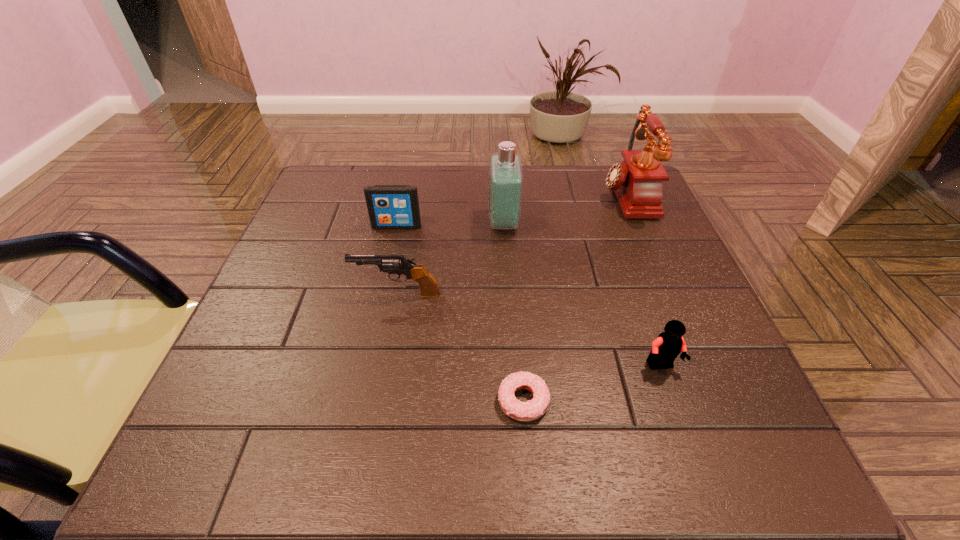
Identify the location of telephone. This screenshot has width=960, height=540. (637, 182).

You are a GUI agent. You are given a task and a screenshot of the screen. Output one action in this format:
    pyautogui.click(x=<x>, y=<y>)
    Task: Click on the perfume
    Image resolution: width=960 pixels, height=540 pixels.
    Given the screenshot: What is the action you would take?
    pyautogui.click(x=505, y=173)

This screenshot has height=540, width=960. I want to click on iPod, so click(389, 206).

Identify the location of gun. The width and height of the screenshot is (960, 540). (392, 264).

What are the coordinates of `the fifth farthest object` in the screenshot? It's located at (666, 347).

Locate an element on the screen. The width and height of the screenshot is (960, 540). doughnut is located at coordinates (533, 409).

Image resolution: width=960 pixels, height=540 pixels. What are the coordinates of `the shortest object` in the screenshot? It's located at (533, 409).

This screenshot has width=960, height=540. I want to click on vacant space located on the dial of the telephone, so click(x=477, y=195).

At what (x,y) coordinates should I click in order to perform the action: click on free point located 0.220m on the dial of the telephone. Please return your answer as a coordinate pair (x, y). This screenshot has height=540, width=960. Looking at the image, I should click on (516, 195).

At what (x,y) coordinates should I click in order to perform the action: click on vacant region located 0.280m on the dial of the telephone. Please return your answer as a coordinate pair (x, y). The width and height of the screenshot is (960, 540). Looking at the image, I should click on (492, 195).